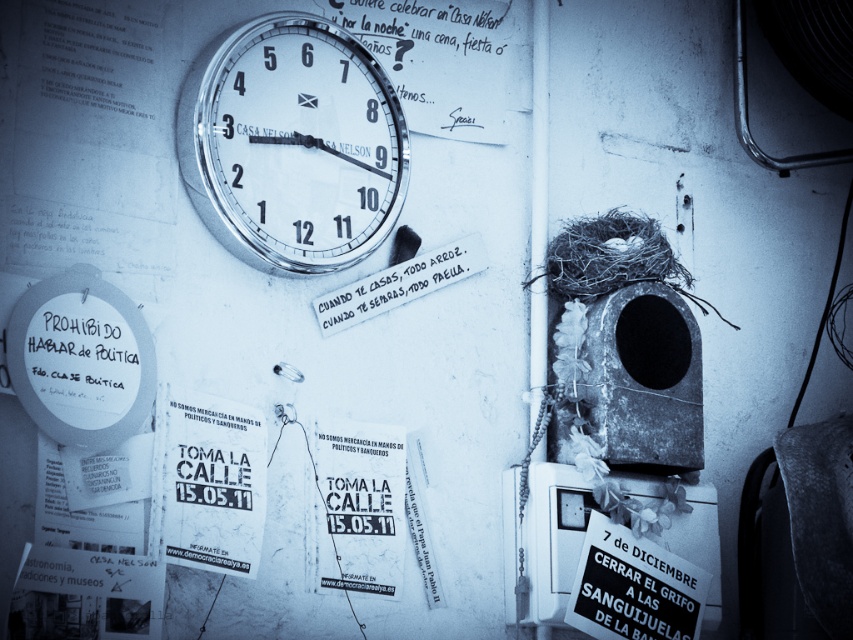
Question: Considering the relative positions of white paper poster at center and matte white text at center in the image provided, where is white paper poster at center located with respect to matte white text at center?

Choices:
 (A) below
 (B) above

Answer: (A)

Question: Does metallic clock at upper center appear over matte white text at center?

Choices:
 (A) no
 (B) yes

Answer: (B)

Question: Which point is closer to the camera?

Choices:
 (A) metallic clock at upper center
 (B) matte white sign at left
 (C) white paper poster at center
 (D) matte white text at center

Answer: (B)

Question: Which object is closer to the camera taking this photo?

Choices:
 (A) matte white text at center
 (B) metallic clock at upper center

Answer: (B)

Question: Which point is farther from the camera taking this photo?

Choices:
 (A) (209, 410)
 (B) (62, 397)
 (C) (357, 289)
 (D) (312, 241)

Answer: (C)

Question: Is metallic clock at upper center in front of matte white sign at left?

Choices:
 (A) no
 (B) yes

Answer: (A)